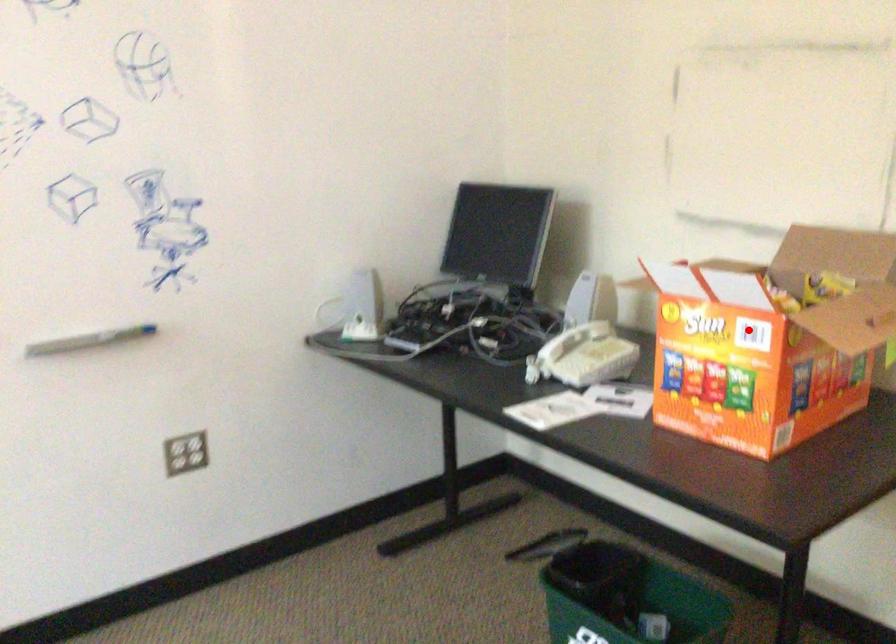
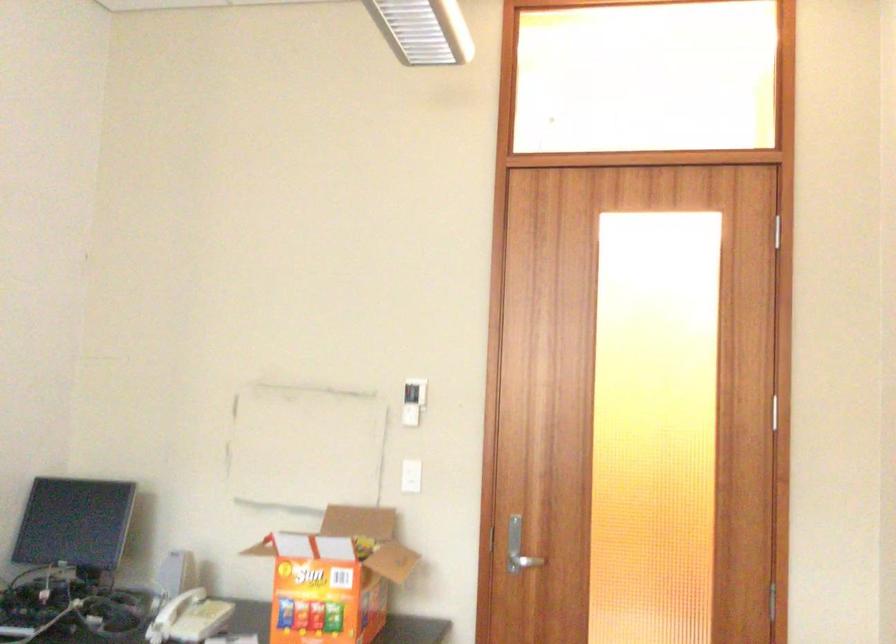
Question: A red point is marked in image1. In image2, is the corresponding 3D point closer to the camera or farther? Reply with the corresponding letter.

Choices:
 (A) The corresponding 3D point is closer.
 (B) The corresponding 3D point is farther.

Answer: (B)